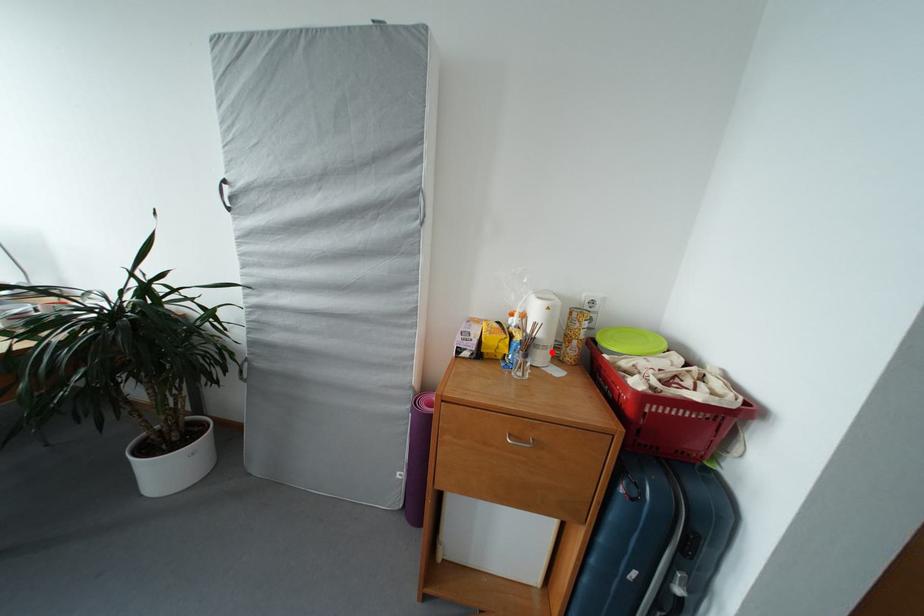
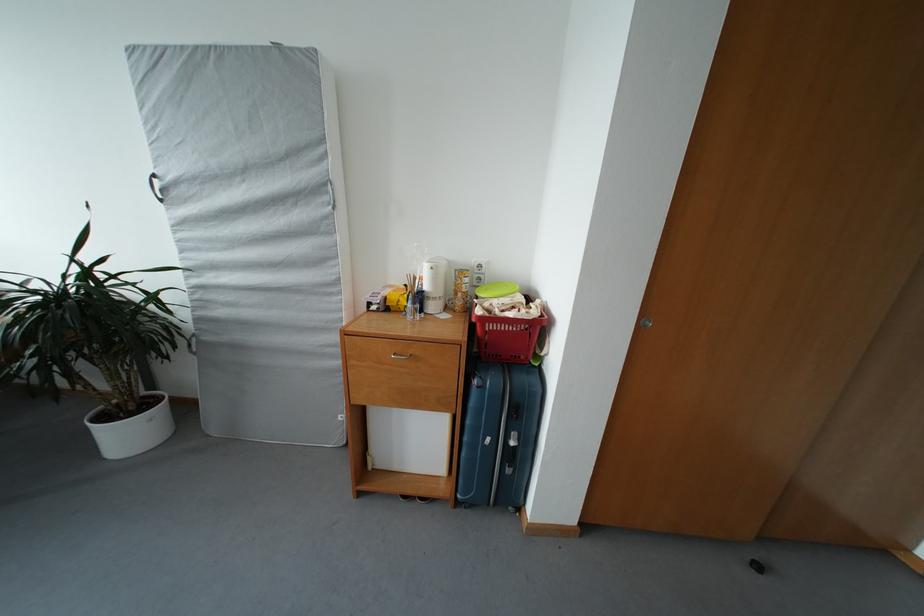
Question: I am providing you with two images of the same scene from different viewpoints. In image1, a red point is highlighted. Considering the same 3D point in image2, which of the following is correct?

Choices:
 (A) It is closer
 (B) It is farther

Answer: (A)